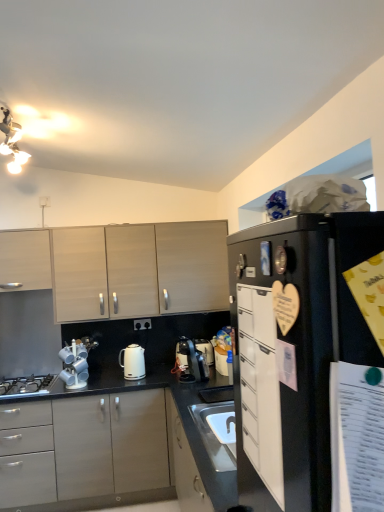
Identify the location of vacant space in front of white glossy kettle at center. This screenshot has height=512, width=384. (123, 386).